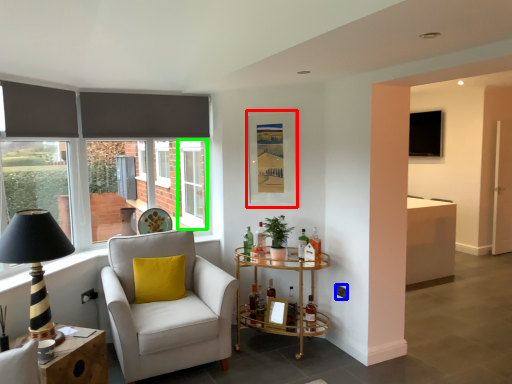
Question: Considering the real-world distances, which object is farthest from picture frame (highlighted by a red box)? power outlet (highlighted by a blue box) or window frame (highlighted by a green box)?

Choices:
 (A) power outlet
 (B) window frame

Answer: (B)